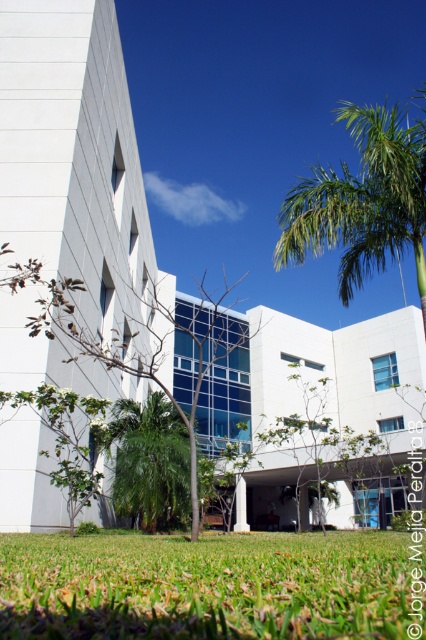
Question: Is green grass at lower center positioned behind green leafy tree at center?

Choices:
 (A) yes
 (B) no

Answer: (B)

Question: Which point is closer to the camera?

Choices:
 (A) green leafy tree at center
 (B) green grass at lower center

Answer: (B)

Question: Is green leafy tree at center in front of green leafy palm tree at center?

Choices:
 (A) no
 (B) yes

Answer: (B)

Question: Which of the following is the farthest from the observer?

Choices:
 (A) click(147, 483)
 (B) click(60, 572)

Answer: (A)

Question: Considering the relative positions of green grass at lower center and green leafy palm tree at center in the image provided, where is green grass at lower center located with respect to green leafy palm tree at center?

Choices:
 (A) right
 (B) left

Answer: (A)

Question: Which object is farther from the camera taking this photo?

Choices:
 (A) green grass at lower center
 (B) green leafy palm tree at center
 (C) green leafy tree at center

Answer: (B)